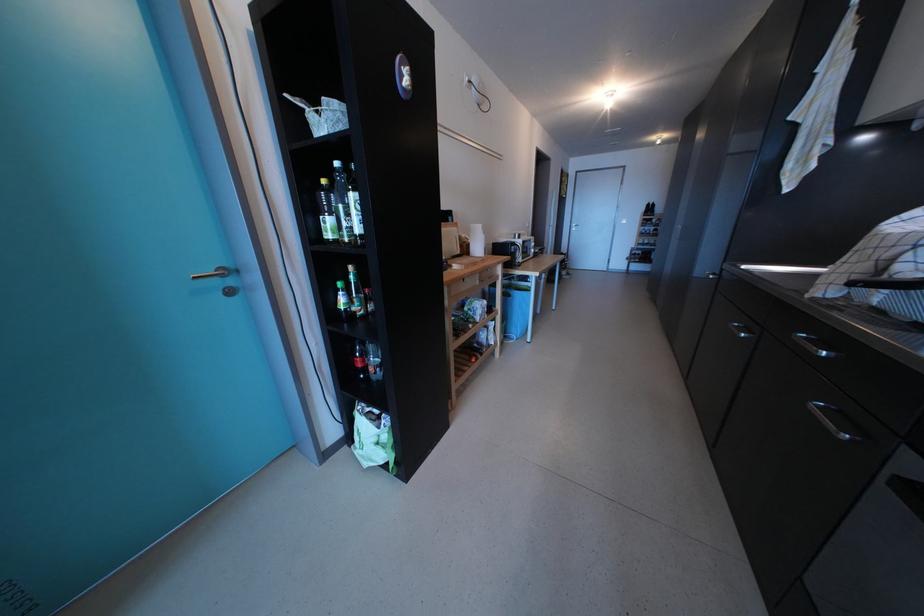
The location [342,205] corresponds to which object?

It refers to a tall glass bottle.